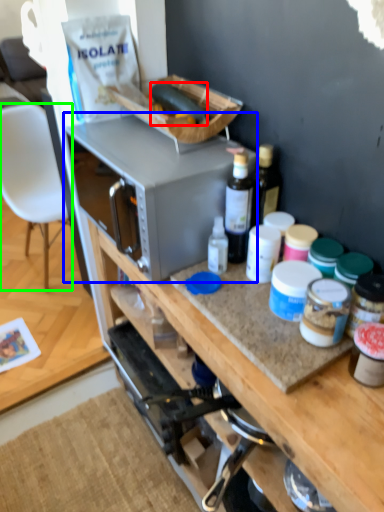
Question: Estimate the real-world distances between objects in this image. Which object is farther from food (highlighted by a red box), microwave oven (highlighted by a blue box) or chair (highlighted by a green box)?

Choices:
 (A) microwave oven
 (B) chair

Answer: (B)